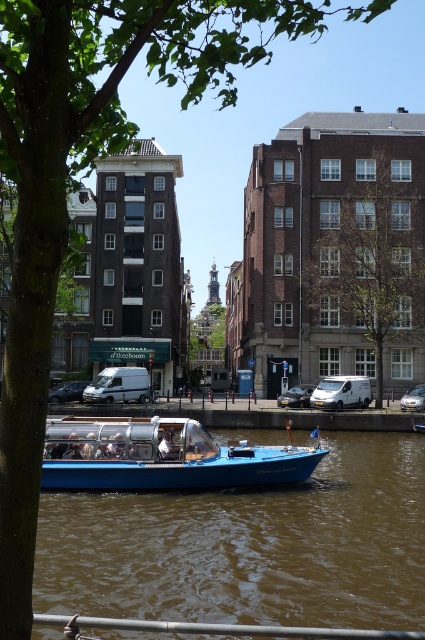
Question: Observing the image, what is the correct spatial positioning of blue plastic boat at lower center in reference to blue glossy boat at center?

Choices:
 (A) above
 (B) below

Answer: (B)

Question: Can you confirm if blue plastic boat at lower center is smaller than blue glossy boat at center?

Choices:
 (A) no
 (B) yes

Answer: (A)

Question: Which object appears closest to the camera in this image?

Choices:
 (A) blue plastic boat at lower center
 (B) green leafy tree at center

Answer: (A)

Question: Which point is closer to the camera taking this photo?

Choices:
 (A) (73, 488)
 (B) (136, 536)

Answer: (B)

Question: Does blue plastic boat at lower center come in front of blue glossy boat at center?

Choices:
 (A) yes
 (B) no

Answer: (A)

Question: Which object is positioned farthest from the blue plastic boat at lower center?

Choices:
 (A) blue glossy boat at center
 (B) green leafy tree at center

Answer: (B)